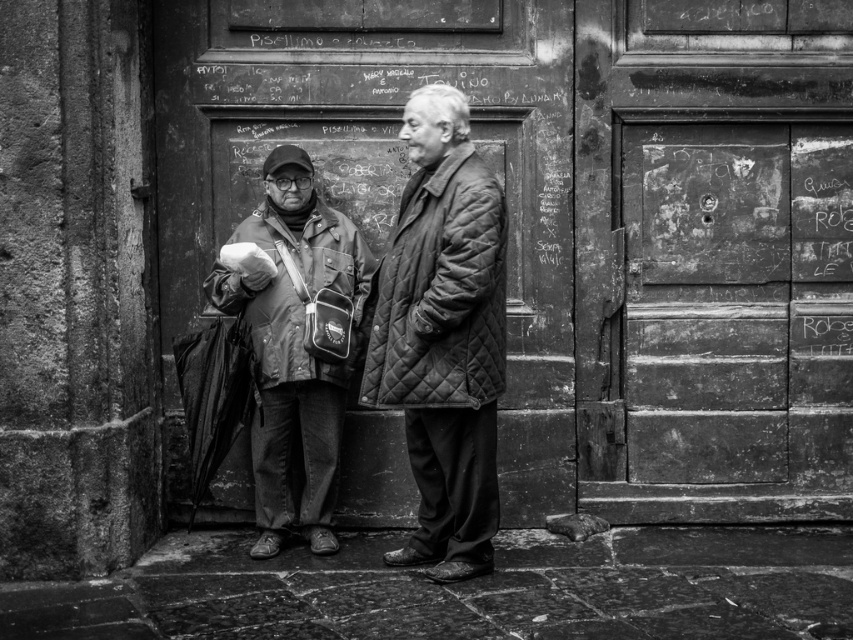
You are a tailor trying to fit a customer for a jacket. You see two jackets in the image, the quilted leather jacket at center and the quilted fabric jacket at center. Which one is narrower?

The quilted leather jacket at center is narrower than the quilted fabric jacket at center.

You are standing in front of the door with the faded text and markings. You need to hand a note to the person wearing the quilted fabric coat at center. Which direction should you move to reach them?

The quilted fabric coat at center is located at point (444, 336), so you should move towards the center to reach them.